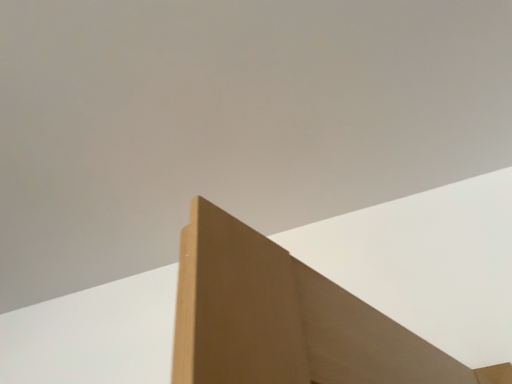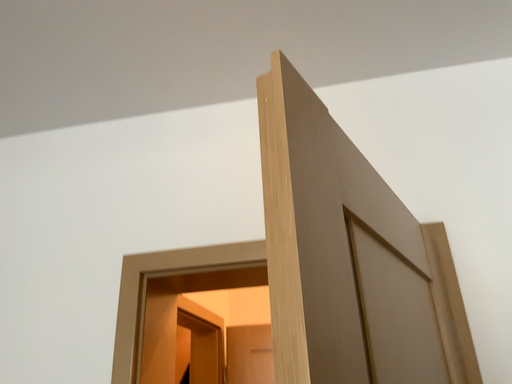
Question: Which way did the camera rotate in the video?

Choices:
 (A) rotated right
 (B) rotated left

Answer: (A)